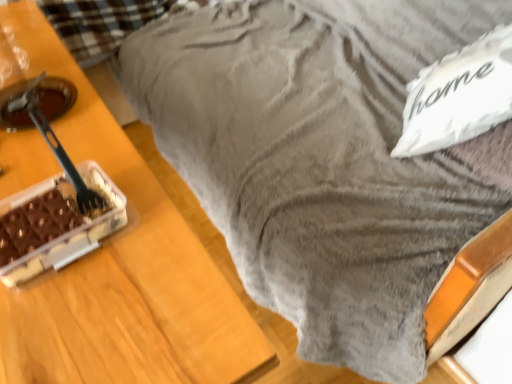
Question: Relative to white fluffy pillow at upper right, is black plastic fork at left in front or behind?

Choices:
 (A) front
 (B) behind

Answer: (A)

Question: Is black plastic fork at left taller or shorter than white fluffy pillow at upper right?

Choices:
 (A) tall
 (B) short

Answer: (B)

Question: Estimate the real-world distances between objects in this image. Which object is farther from the white fluffy pillow at upper right?

Choices:
 (A) chocolate matte cake at left
 (B) black plastic fork at left

Answer: (B)

Question: Which object is the farthest from the black plastic fork at left?

Choices:
 (A) chocolate matte cake at left
 (B) white fluffy pillow at upper right

Answer: (B)